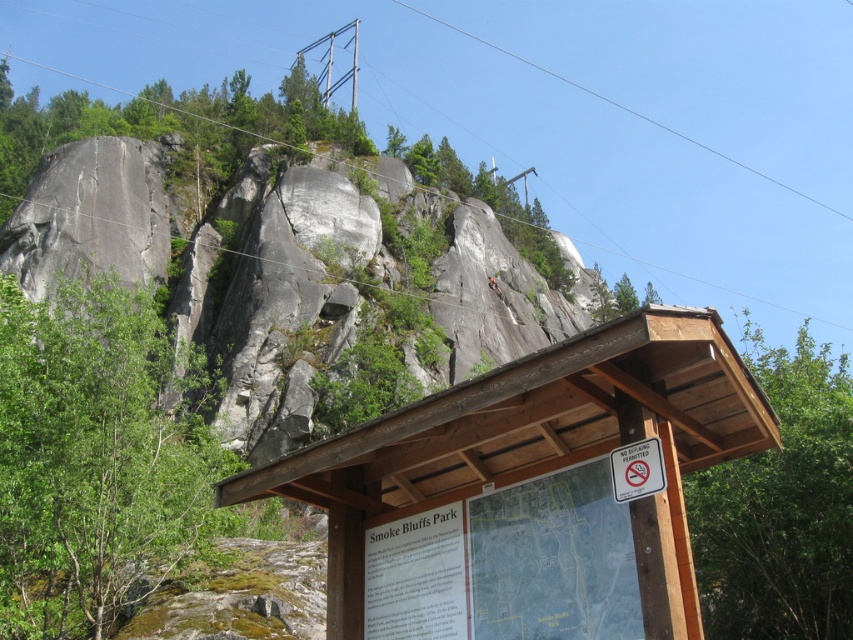
Question: From the image, what is the correct spatial relationship of clear wire at upper center in relation to white plastic sign at lower right?

Choices:
 (A) left
 (B) right

Answer: (B)

Question: Is wooden signboard at lower right positioned behind white plastic sign at lower right?

Choices:
 (A) no
 (B) yes

Answer: (A)

Question: Which of the following is the closest to the observer?

Choices:
 (A) white plastic sign at lower right
 (B) clear wire at upper center

Answer: (A)

Question: Among these objects, which one is farthest from the camera?

Choices:
 (A) clear wire at upper center
 (B) white plastic sign at lower right
 (C) wooden signboard at lower right

Answer: (A)

Question: Is clear wire at upper center smaller than white plastic sign at lower right?

Choices:
 (A) no
 (B) yes

Answer: (A)

Question: Which of the following is the farthest from the observer?

Choices:
 (A) wooden signboard at lower right
 (B) clear wire at upper center

Answer: (B)